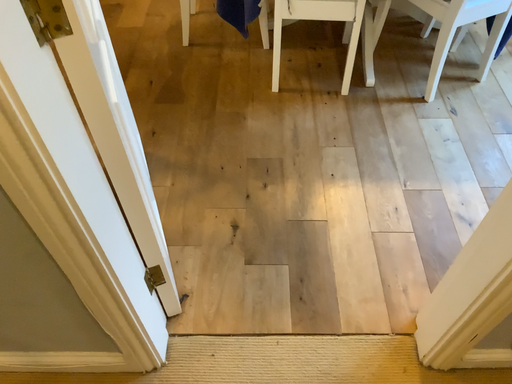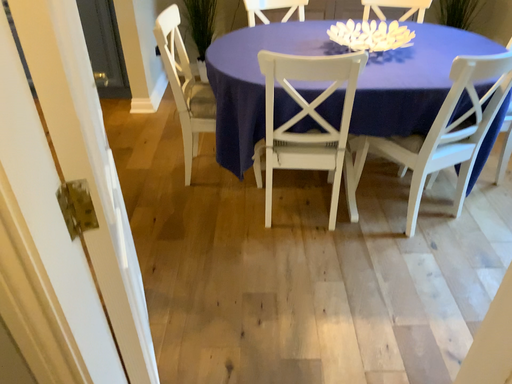
Question: How did the camera likely rotate when shooting the video?

Choices:
 (A) rotated downward
 (B) rotated upward

Answer: (B)